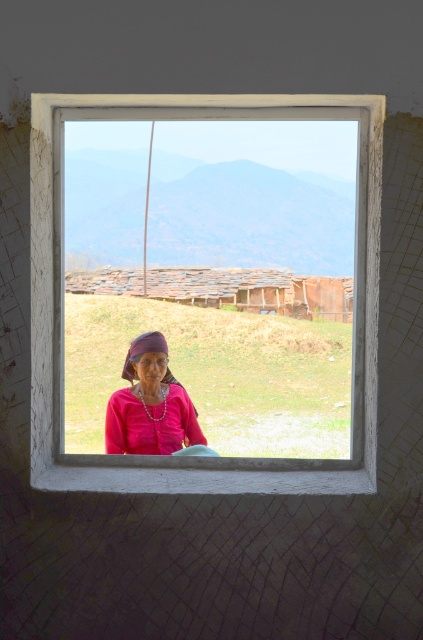
Does white wooden window frame at center appear on the left side of matte pink fabric at center?

In fact, white wooden window frame at center is to the right of matte pink fabric at center.

Who is more forward, (213, 96) or (156, 364)?

Point (213, 96)

Identify the location of white wooden window frame at center. (54, 332).